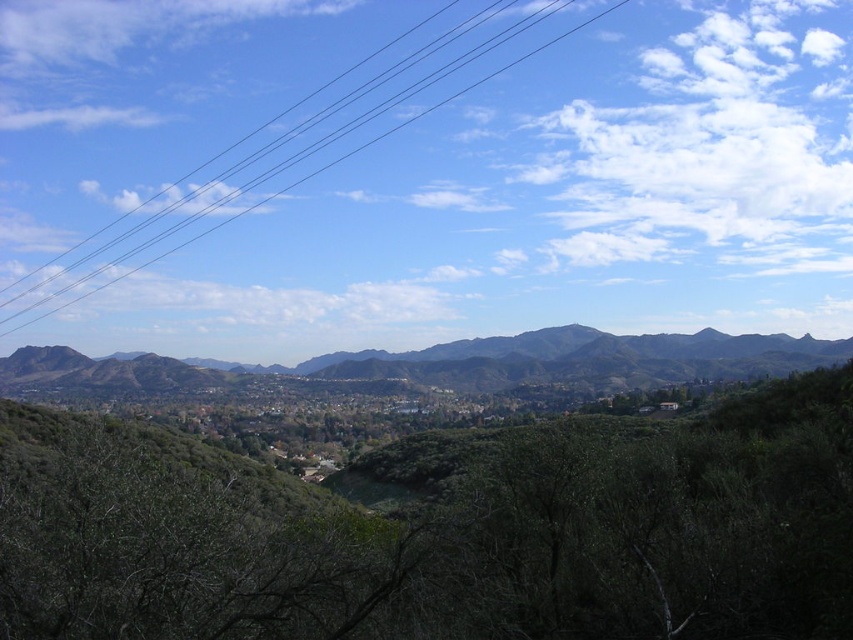
Does green leafy tree at center have a lesser width compared to black wire at upper center?

Yes, green leafy tree at center is thinner than black wire at upper center.

What do you see at coordinates (466, 541) in the screenshot? This screenshot has width=853, height=640. I see `green leafy tree at center` at bounding box center [466, 541].

At what (x,y) coordinates should I click in order to perform the action: click on green leafy tree at center. Please return your answer as a coordinate pair (x, y). Image resolution: width=853 pixels, height=640 pixels. Looking at the image, I should click on (466, 541).

Which is more to the right, green leafy tree at center or green textured mountain at center?

green leafy tree at center is more to the right.

Who is taller, green leafy tree at center or green textured mountain at center?

With more height is green textured mountain at center.

Find the location of a particular element. green leafy tree at center is located at coordinates (466, 541).

Which of these two, green textured mountain at center or black wire at upper center, stands shorter?

green textured mountain at center is shorter.

Can you confirm if green textured mountain at center is shorter than black wire at upper center?

Correct, green textured mountain at center is not as tall as black wire at upper center.

Who is more distant from viewer, (631, 369) or (613, 4)?

The point (613, 4) is more distant.

Identify the location of green textured mountain at center. (467, 362).